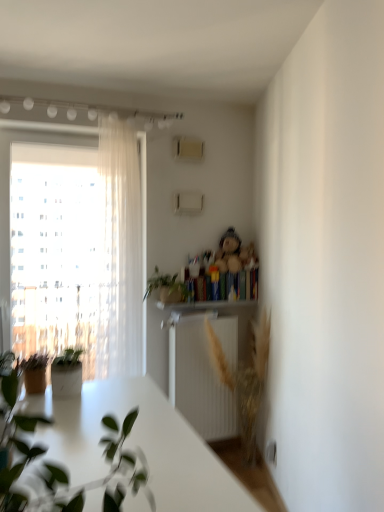
Image resolution: width=384 pixels, height=512 pixels. I want to click on free space above transparent glass window at left (from a real-world perspective), so click(x=41, y=137).